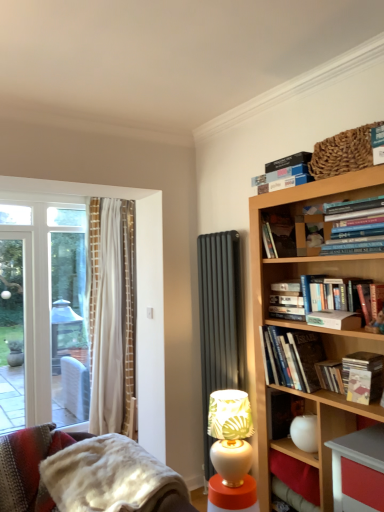
Question: From their relative heights in the image, would you say hardcover book at center-right, which is the 5th paperback book from top to bottom, is taller or shorter than white glossy table lamp at lower center?

Choices:
 (A) short
 (B) tall

Answer: (A)

Question: Is hardcover book at center-right, arranged as the first paperback book when ordered from the bottom, situated inside white glossy table lamp at lower center or outside?

Choices:
 (A) inside
 (B) outside

Answer: (B)

Question: Estimate the real-world distances between objects in this image. Which object is closer to the hardcover book at upper right, which is the 5th paperback book in bottom-to-top order?

Choices:
 (A) fuzzy woolen blanket at lower left
 (B) hardcover book at upper right, acting as the 2th paperback book starting from the bottom
 (C) hardcover book at upper right, placed as the 5th book when sorted from top to bottom
 (D) hardcover book at upper center, the 3th book viewed from the top
 (E) hardcover book at upper right, which is the fourth book in top-to-bottom order

Answer: (D)

Question: Estimate the real-world distances between objects in this image. Which object is closer to the hardcover book at center-right, which is the 5th paperback book from top to bottom?

Choices:
 (A) white glossy table lamp at lower center
 (B) hardcover book at upper right, marked as the fourth paperback book in a bottom-to-top arrangement
 (C) hardcover book at upper right, which is the 5th paperback book in bottom-to-top order
 (D) matte yellow paperback book at upper right, arranged as the 3th paperback book when ordered from the bottom
 (E) hardcover book at upper right, which is the 2th book in bottom-to-top order

Answer: (E)